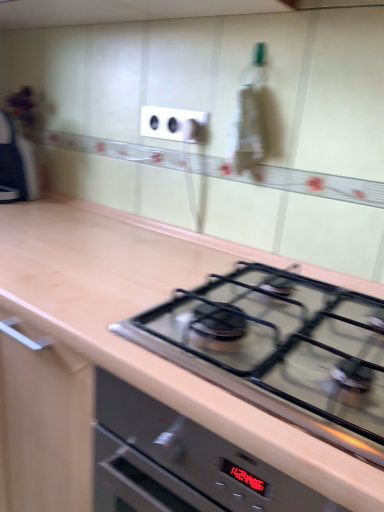
Question: In terms of size, does satin black gas stove at center appear bigger or smaller than matte black knob at upper center?

Choices:
 (A) big
 (B) small

Answer: (A)

Question: From a real-world perspective, relative to matte black knob at upper center, is satin black gas stove at center vertically above or below?

Choices:
 (A) above
 (B) below

Answer: (B)

Question: Which is nearer to the matte black knob at upper center?

Choices:
 (A) satin black gas stove at center
 (B) white plastic electrical outlet at upper center

Answer: (B)

Question: Considering the real-world distances, which object is closest to the matte black knob at upper center?

Choices:
 (A) white plastic electrical outlet at upper center
 (B) satin black gas stove at center

Answer: (A)